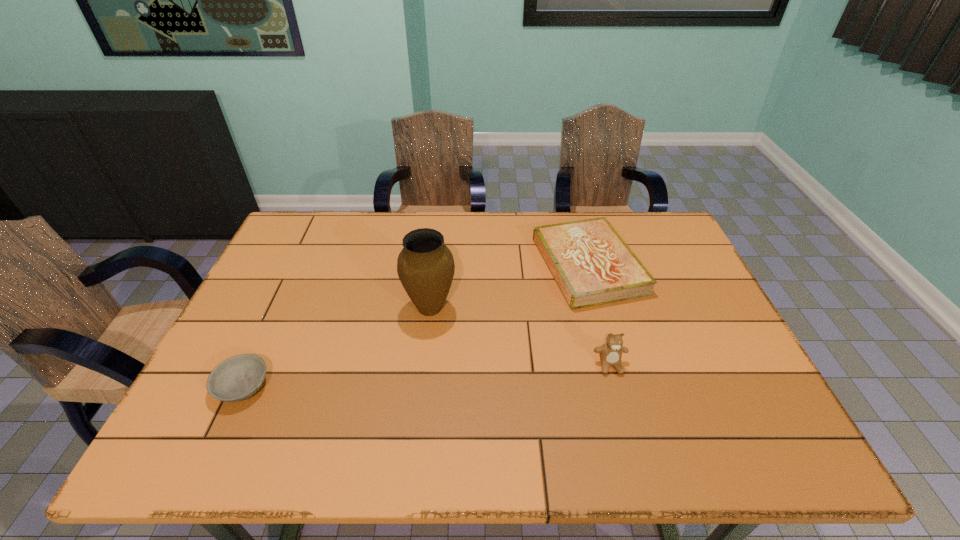
Where is `free space between the hardback book and the teddy bear`? This screenshot has height=540, width=960. free space between the hardback book and the teddy bear is located at coordinates (599, 315).

At what (x,y) coordinates should I click in order to perform the action: click on free area in between the third shortest object and the second shortest object. Please return your answer as a coordinate pair (x, y). This screenshot has width=960, height=540. Looking at the image, I should click on (599, 315).

Identify the location of free space between the hardback book and the teddy bear. (599, 315).

You are a GUI agent. You are given a task and a screenshot of the screen. Output one action in this format:
    pyautogui.click(x=<x>, y=<y>)
    Task: Click on the free space between the tallest object and the shortest object
    Image resolution: width=960 pixels, height=540 pixels.
    Given the screenshot: What is the action you would take?
    pyautogui.click(x=336, y=347)

Find the location of `empty location between the tallest object and the third tallest object`. empty location between the tallest object and the third tallest object is located at coordinates (510, 286).

This screenshot has height=540, width=960. I want to click on vacant space in between the teddy bear and the shortest object, so click(426, 375).

Where is `free spot between the third object from right to left and the leftmost object`? free spot between the third object from right to left and the leftmost object is located at coordinates (336, 347).

Where is `free space that is in between the bowl and the teddy bear`? The image size is (960, 540). free space that is in between the bowl and the teddy bear is located at coordinates (426, 375).

This screenshot has height=540, width=960. Find the location of `empty location between the leftmost object and the second tallest object`. empty location between the leftmost object and the second tallest object is located at coordinates (426, 375).

You are a GUI agent. You are given a task and a screenshot of the screen. Output one action in this format:
    pyautogui.click(x=<x>, y=<y>)
    Task: Click on the free space between the teddy bear and the bowl
    The image size is (960, 540).
    Given the screenshot: What is the action you would take?
    pyautogui.click(x=426, y=375)